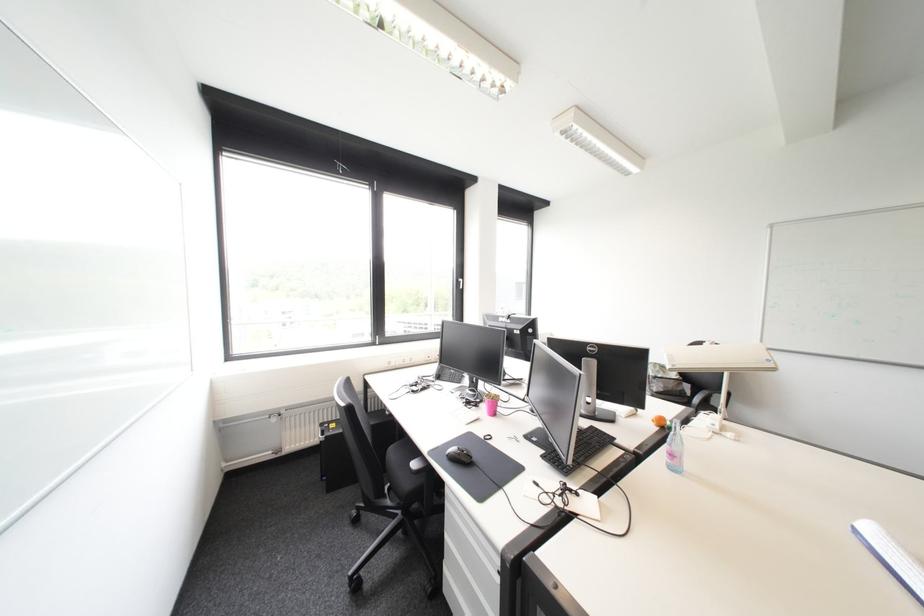
The location [579,448] corresponds to which object?

It corresponds to the black computer keyboard in the image.